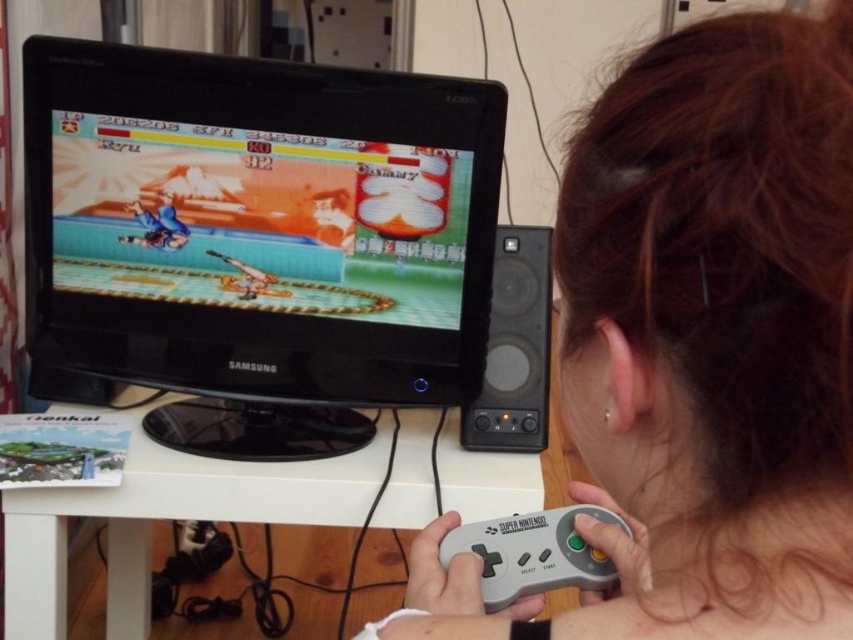
Measure the distance between white plastic table at lower center and gray matte game controller at lower center.

white plastic table at lower center and gray matte game controller at lower center are 45.51 centimeters apart from each other.

Is point (252, 493) positioned behind point (561, 572)?

Yes, point (252, 493) is behind point (561, 572).

Find the location of a particular element. This screenshot has height=640, width=853. white plastic table at lower center is located at coordinates (x=166, y=518).

Is gray matte controller at lower center to the right of white plastic table at lower center from the viewer's perspective?

Yes, gray matte controller at lower center is to the right of white plastic table at lower center.

Can you confirm if gray matte controller at lower center is smaller than white plastic table at lower center?

Yes, gray matte controller at lower center is smaller than white plastic table at lower center.

Is point (819, 205) closer to camera compared to point (392, 500)?

Yes, it is.

Image resolution: width=853 pixels, height=640 pixels. Identify the location of gray matte controller at lower center. (700, 346).

In the scene shown: Which is above, matte black monitor at center or white plastic table at lower center?

matte black monitor at center is higher up.

Can you confirm if matte black monitor at center is smaller than white plastic table at lower center?

Actually, matte black monitor at center might be larger than white plastic table at lower center.

Is point (47, 317) behind point (136, 438)?

Yes.

Where is `matte black monitor at center`? matte black monitor at center is located at coordinates (259, 236).